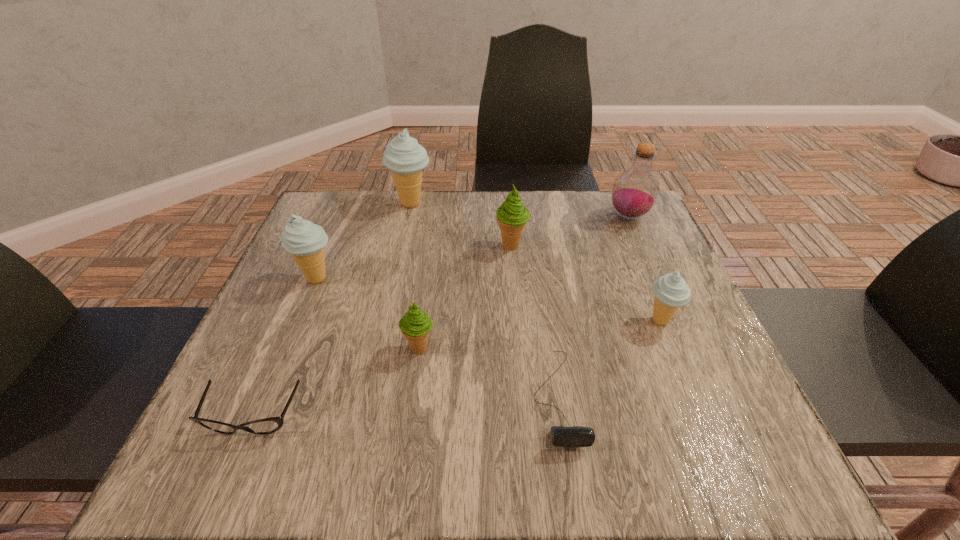
Image resolution: width=960 pixels, height=540 pixels. Find the location of `vacant space that satisfies the following two spatial constraints: 1. on the back side of the rightmost beige icecream; 2. on the right side of the left green icecream`. vacant space that satisfies the following two spatial constraints: 1. on the back side of the rightmost beige icecream; 2. on the right side of the left green icecream is located at coordinates (422, 321).